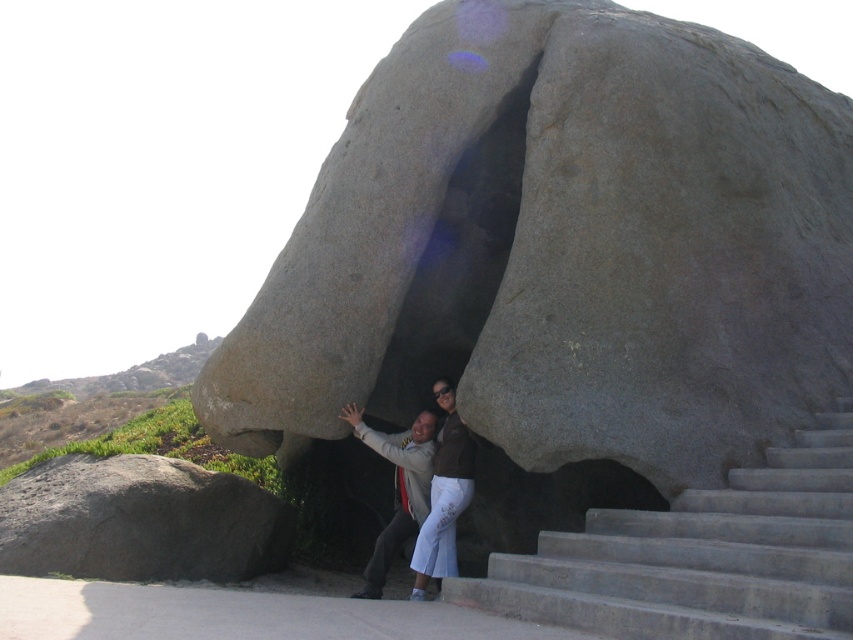
Question: Does gray rough boulder at lower left appear on the right side of matte gray stone couple at center?

Choices:
 (A) yes
 (B) no

Answer: (B)

Question: Among these objects, which one is farthest from the camera?

Choices:
 (A) denim pants at center
 (B) matte gray stone couple at center
 (C) gray granite rock at center

Answer: (A)

Question: Among these objects, which one is nearest to the camera?

Choices:
 (A) denim pants at center
 (B) matte gray stone couple at center
 (C) gray rough boulder at lower left
 (D) gray granite rock at center

Answer: (D)

Question: Which object is closer to the camera taking this photo?

Choices:
 (A) gray rough boulder at lower left
 (B) gray granite rock at center
 (C) denim pants at center

Answer: (B)

Question: Is gray granite rock at center smaller than denim pants at center?

Choices:
 (A) yes
 (B) no

Answer: (B)

Question: Can you confirm if concrete stairs at lower right is smaller than denim pants at center?

Choices:
 (A) no
 (B) yes

Answer: (A)